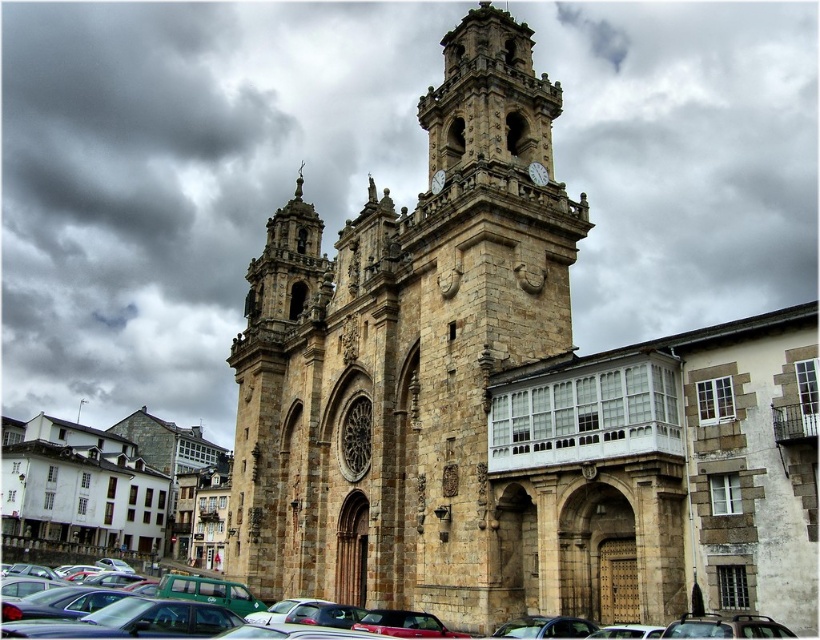
You are standing in the town square in front of the historic stone church. You notice two points marked on the ground. One is at coordinates point (607, 451) and the other at point (194, 602). If you are facing the church, which point is closer to the church building?

Point (607, 451) is behind point (194, 602), so when facing the church, point (607, 451) is closer to the church building.

You are a photographer planning to capture a wide shot of the stone church at center and the metallic silver car at lower center. Given their sizes, which object should you position closer to the camera to ensure both fit within the frame?

Since the stone church at center is wider than the metallic silver car at lower center, positioning the metallic silver car at lower center closer to the camera would help balance their apparent sizes in the frame.

You are standing in the town square and see the stone church at center and the metallic silver car at lower center. Which object is positioned higher in the image?

The stone church at center is above the metallic silver car at lower center, so it is positioned higher in the image.